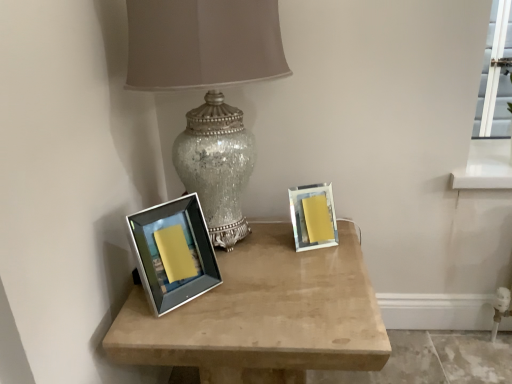
This screenshot has width=512, height=384. Identify the location of free space in front of crackle glass lamp at center. point(253,310).